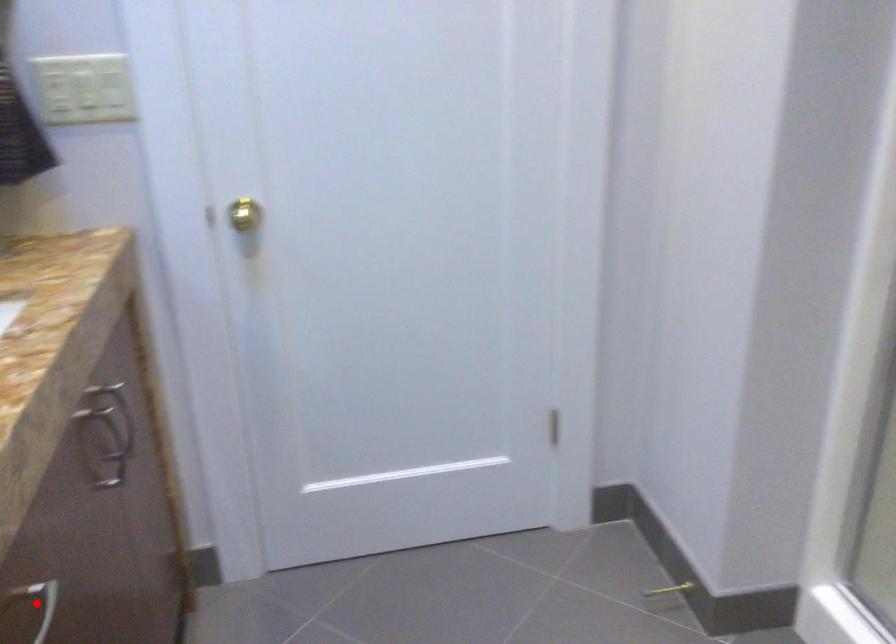
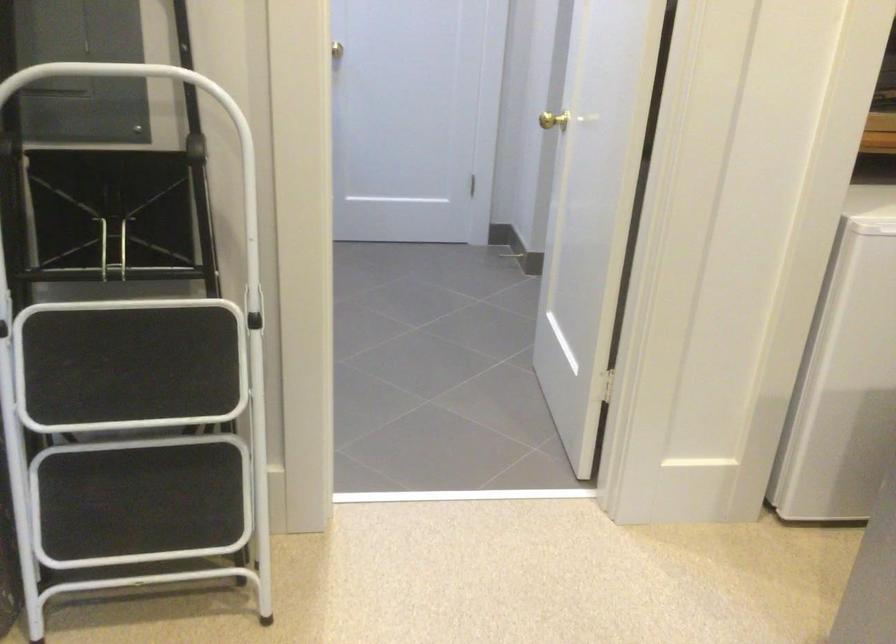
Question: I am providing you with two images of the same scene from different viewpoints. A red point is marked on the first image. At the location where the point appears in image 1, is it still visible in image 2?

Choices:
 (A) Yes
 (B) No

Answer: (B)